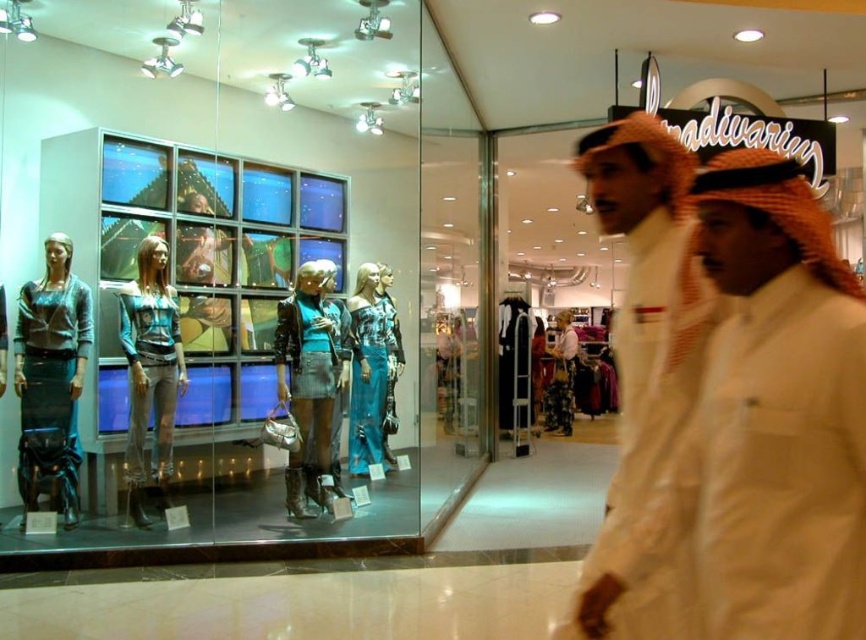
You are a customer in the store and want to examine both the blue satin dress at center and the floral fabric dress at center. Which dress should you approach first to get a closer look?

You should approach the blue satin dress at center first because it is closer to you than the floral fabric dress at center.

You are a customer in the store and want to take a photo of both the metallic silver boots at center and the floral fabric dress at center. Since the glass window is reflecting the lights, which object should you position closer to the window to avoid reflections in your photo?

The metallic silver boots at center is located above the floral fabric dress at center. Position the metallic silver boots at center closer to the window to avoid reflections, as it is above and might be less affected by the reflections from the glass window below.